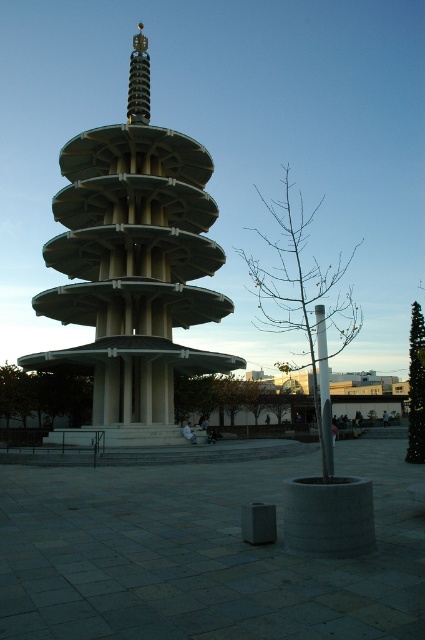
Is green concrete tower at center to the left of matte gray pillar at center from the viewer's perspective?

Correct, you'll find green concrete tower at center to the left of matte gray pillar at center.

Who is shorter, green concrete tower at center or matte gray pillar at center?

With less height is matte gray pillar at center.

What are the coordinates of `green concrete tower at center` in the screenshot? It's located at (133, 266).

Where is `green concrete tower at center`? The width and height of the screenshot is (425, 640). green concrete tower at center is located at coordinates (133, 266).